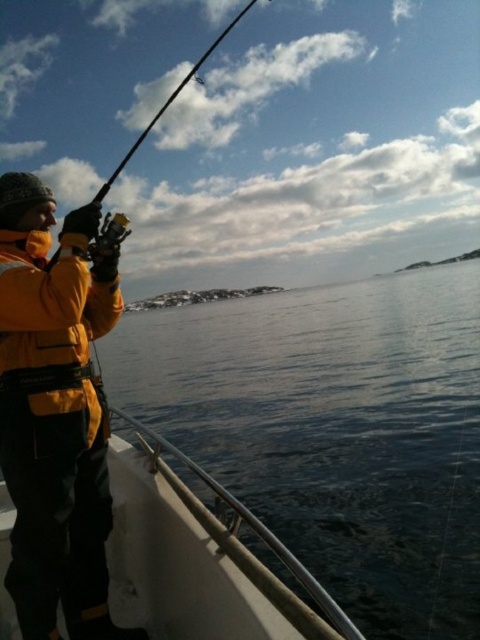
You are standing on the shore and looking at the transparent water at lower center and the white matte boat at lower left. Which object is closer to you?

The transparent water at lower center is closer to you because it is further to the viewer than the white matte boat at lower left, meaning it appears nearer in the visual perspective.

You are planning to take a photo of the transparent water at lower center and the white matte boat at lower left. Based on the scene, which object should you focus on first if you want to capture both in a single frame without moving the camera?

The transparent water at lower center should be focused on first because it is larger in size than the white matte boat at lower left, making it the primary subject for the frame.

You are planning to take a photo of the fishing scene. The camera can only focus on one object at a time. Which object between the transparent water at lower center and the yellow matte jacket at left should you focus on to capture the larger object in the frame?

The transparent water at lower center is bigger than the yellow matte jacket at left, so you should focus on the transparent water at lower center to capture the larger object in the frame.